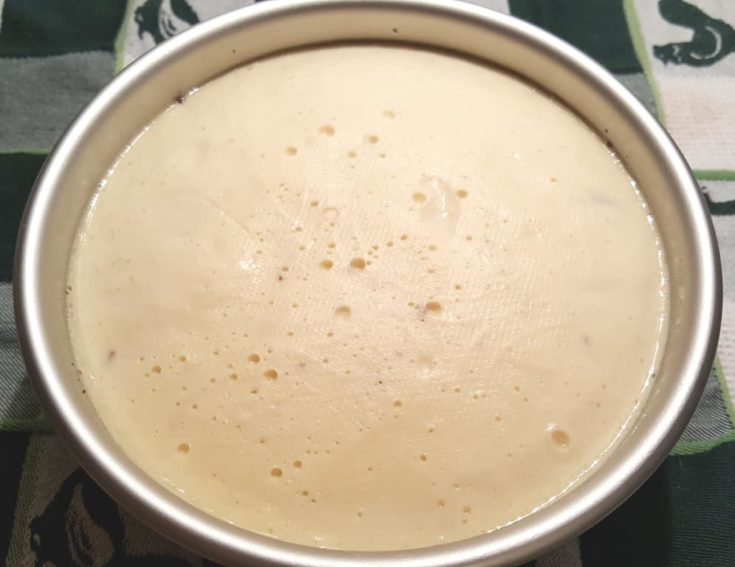
Locate an element on the screen. Image resolution: width=735 pixels, height=567 pixels. table cloth is located at coordinates (705, 104).